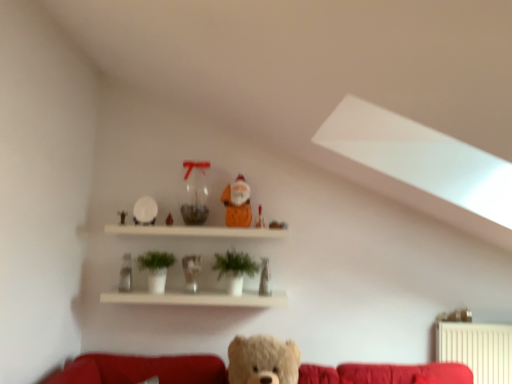
Question: Would you say green matte plant at center is to the left or to the right of matte orange santa at upper center, the third toy from the left, in the picture?

Choices:
 (A) left
 (B) right

Answer: (A)

Question: Is green matte plant at center wider or thinner than matte orange santa at upper center, marked as the third toy in a right-to-left arrangement?

Choices:
 (A) wide
 (B) thin

Answer: (A)

Question: Which is nearer to the translucent glass figurine at center, the second figurine from the right?

Choices:
 (A) white glossy shelf at upper center
 (B) matte glass vase at upper center, the 2th figurine from the left
 (C) matte orange santa at upper center, the 5th toy viewed from the left
 (D) matte orange santa at upper center, the third toy from the left
 (E) clear glass vase at center, the 5th toy when ordered from right to left

Answer: (A)

Question: Which of these objects is positioned farthest from the matte orange santa at upper center, marked as the third toy in a right-to-left arrangement?

Choices:
 (A) clear glass vase at center, which ranks as the first toy in left-to-right order
 (B) white glossy shelf at upper center
 (C) green matte plant at center
 (D) matte orange santa at upper center, the 1th toy viewed from the right
 (E) matte orange santa at upper center, the 4th toy viewed from the left

Answer: (A)